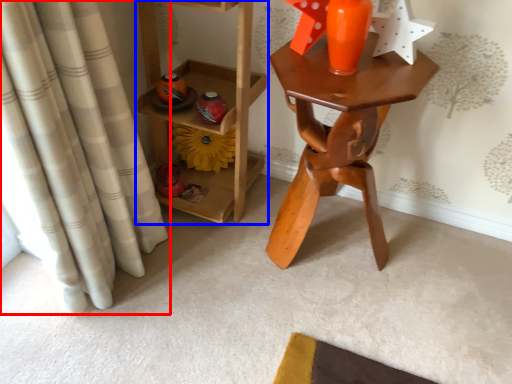
Question: Among these objects, which one is nearest to the camera, curtain (highlighted by a red box) or furniture (highlighted by a blue box)?

Choices:
 (A) curtain
 (B) furniture

Answer: (A)